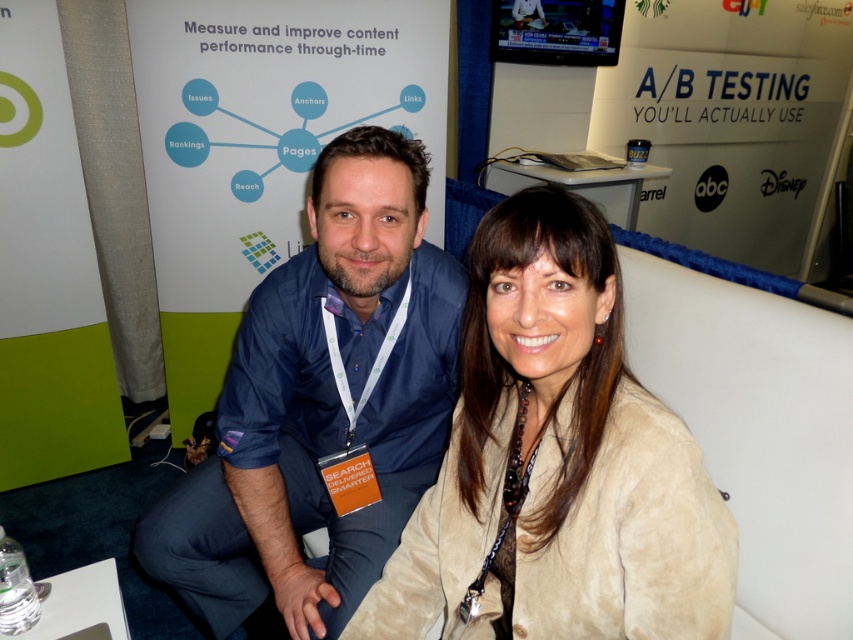
Question: Can you confirm if beige suede jacket at center is positioned to the left of blue cotton shirt at center?

Choices:
 (A) yes
 (B) no

Answer: (B)

Question: Which point is farther from the camera taking this photo?

Choices:
 (A) (677, 497)
 (B) (231, 566)

Answer: (B)

Question: Is beige suede jacket at center above blue cotton shirt at center?

Choices:
 (A) yes
 (B) no

Answer: (A)

Question: Is beige suede jacket at center smaller than blue cotton shirt at center?

Choices:
 (A) no
 (B) yes

Answer: (B)

Question: Which point appears farthest from the camera in this image?

Choices:
 (A) (263, 472)
 (B) (647, 502)

Answer: (A)